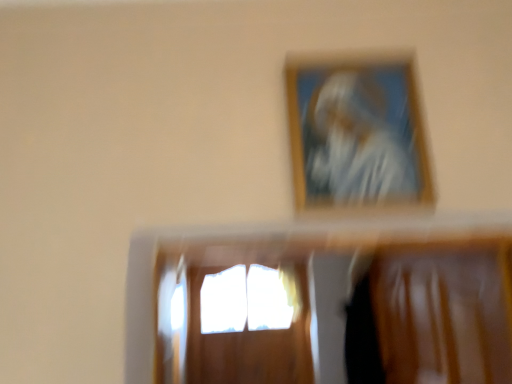
Question: From the image's perspective, is translucent glass window at center above or below wooden picture frame at upper center?

Choices:
 (A) below
 (B) above

Answer: (A)

Question: From a real-world perspective, relative to wooden picture frame at upper center, is translucent glass window at center vertically above or below?

Choices:
 (A) above
 (B) below

Answer: (B)

Question: Considering the positions of translucent glass window at center and wooden picture frame at upper center in the image, is translucent glass window at center bigger or smaller than wooden picture frame at upper center?

Choices:
 (A) big
 (B) small

Answer: (A)

Question: Choose the correct answer: Is wooden picture frame at upper center inside translucent glass window at center or outside it?

Choices:
 (A) outside
 (B) inside

Answer: (A)

Question: In terms of size, does wooden picture frame at upper center appear bigger or smaller than translucent glass window at center?

Choices:
 (A) big
 (B) small

Answer: (B)

Question: From the image's perspective, relative to translucent glass window at center, is wooden picture frame at upper center above or below?

Choices:
 (A) above
 (B) below

Answer: (A)

Question: Relative to translucent glass window at center, is wooden picture frame at upper center in front or behind?

Choices:
 (A) front
 (B) behind

Answer: (A)